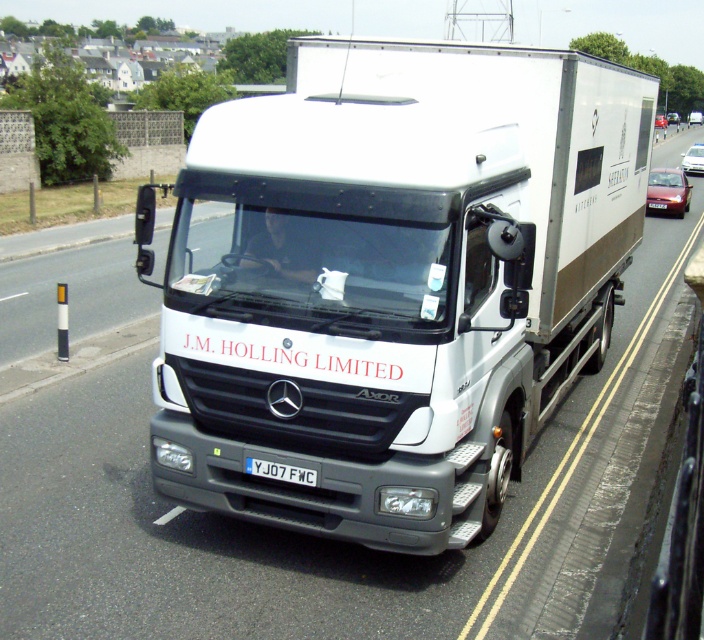
Based on the photo, you are a traffic officer observing a Mercedes Benz Axor truck on a multi lane road. You notice the white matte trailer truck at center and the white plastic license plate at center. Which object is positioned to the right side of the other?

The white matte trailer truck at center is to the right of the white plastic license plate at center.

You are a traffic officer observing a Mercedes truck with a white plastic license plate at center and a metallic silver sedan at center on a multi lane road. Which object is positioned lower in the image?

The white plastic license plate at center is located below the metallic silver sedan at center, so it is positioned lower in the image.

You are a driver in a car behind the Mercedes truck. You notice two sedans ahead at the center of your view. Which sedan is closer to you, the metallic silver sedan at center or the shiny red sedan at center?

The metallic silver sedan at center is closer to you because it is positioned below the shiny red sedan at center, indicating it is in front in the line of sight.